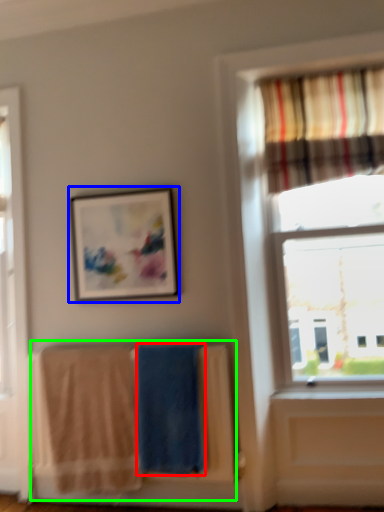
Question: Which is nearer to the beach towel (highlighted by a red box)? picture frame (highlighted by a blue box) or laundry (highlighted by a green box).

Choices:
 (A) picture frame
 (B) laundry

Answer: (B)